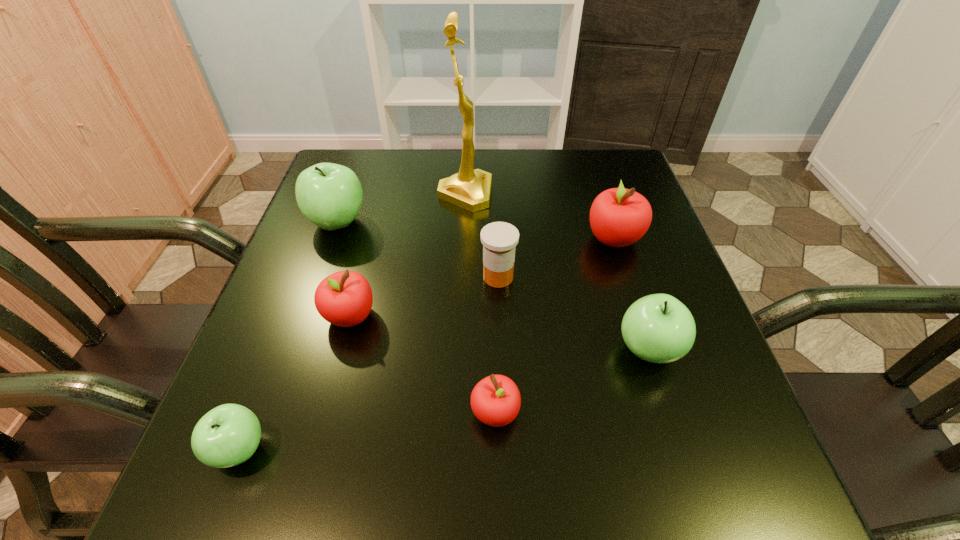
Identify the location of the fifth nearest object. Image resolution: width=960 pixels, height=540 pixels. (499, 239).

The height and width of the screenshot is (540, 960). I want to click on the second red apple from right to left, so click(x=495, y=400).

Find the location of a particular element. the smallest red apple is located at coordinates (495, 400).

Find the location of a particular element. This screenshot has width=960, height=540. the nearest green apple is located at coordinates (228, 435).

I want to click on vacant area situated on the front-facing side of the golden award, so click(516, 195).

At what (x,y) coordinates should I click in order to perform the action: click on free region located 0.350m on the front of the farthest red apple. Please return your answer as a coordinate pair (x, y). Image resolution: width=960 pixels, height=540 pixels. Looking at the image, I should click on (669, 410).

Find the location of a particular element. free space located 0.400m on the front of the farthest green apple is located at coordinates (271, 412).

Where is `free spot located 0.300m on the back of the second biggest green apple`? The height and width of the screenshot is (540, 960). free spot located 0.300m on the back of the second biggest green apple is located at coordinates (608, 222).

I want to click on vacant region located 0.150m on the front of the leftmost red apple, so [x=324, y=416].

Identify the location of vacant space located 0.140m on the label of the orange medicine. The width and height of the screenshot is (960, 540). (412, 277).